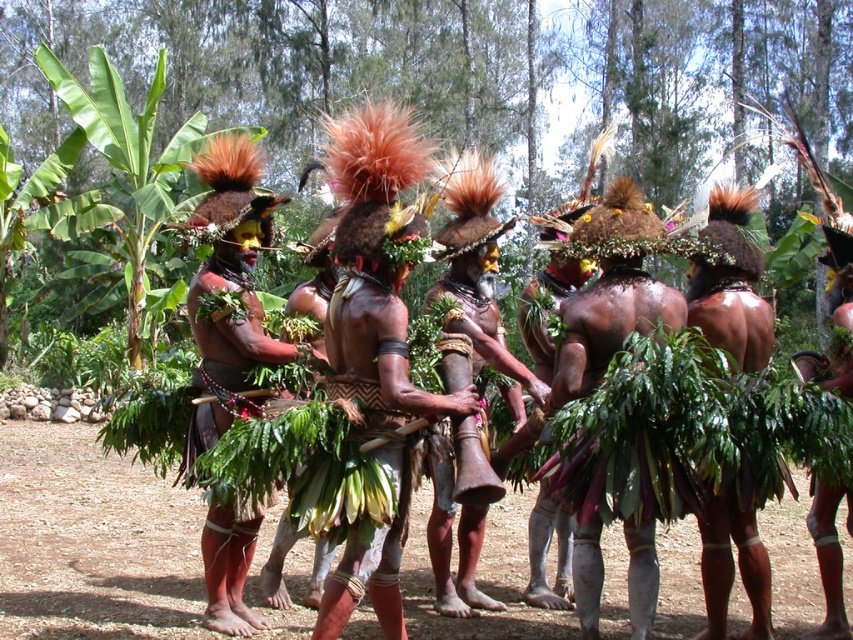
You are an anthropologist studying the spatial arrangement of ceremonial attire in this image. The brown textured leaf skirt at center is positioned at coordinates 0.489, 0.448. What does this coordinate indicate about its placement in the image?

The coordinates (381, 312) indicate that the brown textured leaf skirt at center is positioned near the center of the image, as both values are close to 0.5, which typically represents the midpoint in a normalized coordinate system.

You are an anthropologist observing this traditional dance performance. You notice two skirts at the center of the image. Which skirt is positioned lower on the dancer? The brown textured leaf skirt at center or the green leafy skirt at center?

The brown textured leaf skirt at center is located below the green leafy skirt at center, so it is positioned lower on the dancer.